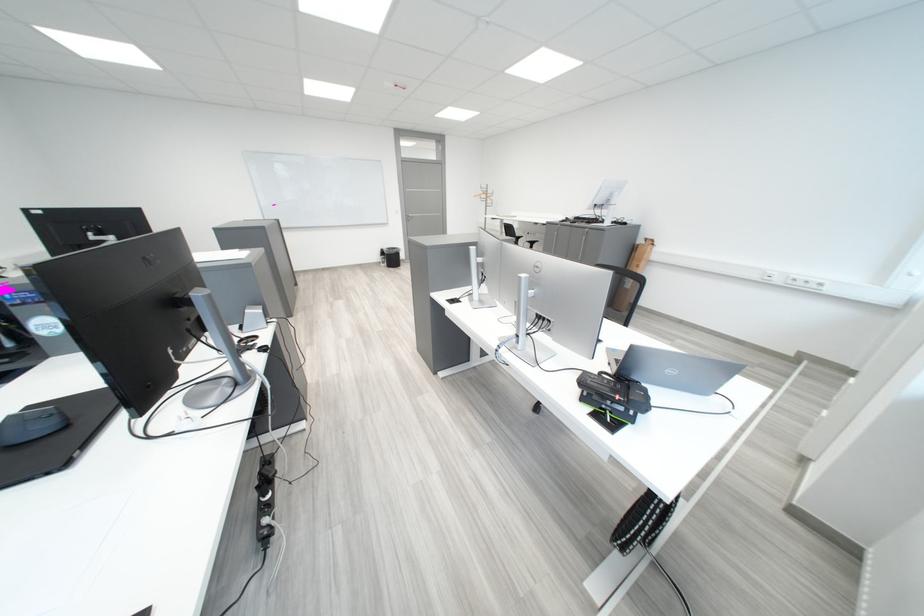
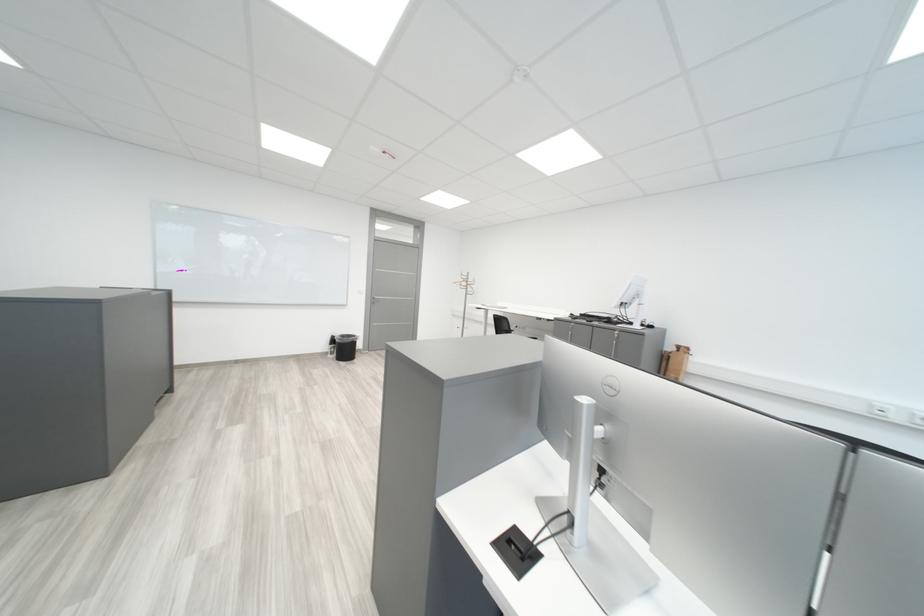
Locate, in the second image, the point that corresponds to pixel 653 243 in the first image.

(684, 349)